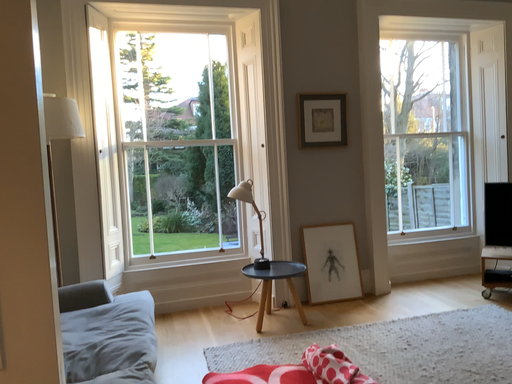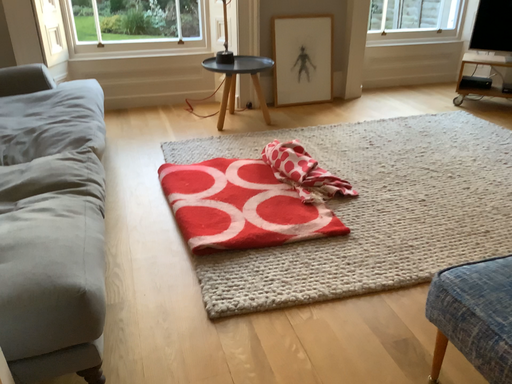
Question: How did the camera likely rotate when shooting the video?

Choices:
 (A) rotated downward
 (B) rotated upward

Answer: (A)